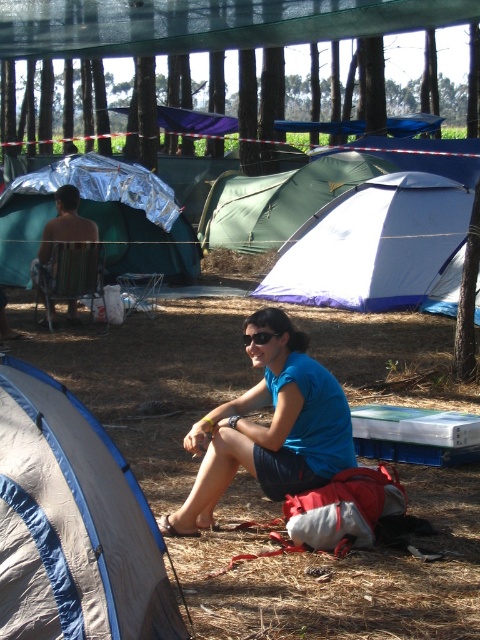
You are a hiker who wants to set up a campsite. You see the white nylon tent at center and the shiny metallic chair at left. Which object is closer to you?

The white nylon tent at center is closer to you because it is further to the viewer than the shiny metallic chair at left.

Consider the image. You are a photographer setting up equipment in the camping scene. You have a shiny metallic chair at left and black plastic goggles at center. Which object is closer to you?

The shiny metallic chair at left is closer to you because it is further to the viewer than the black plastic goggles at center.